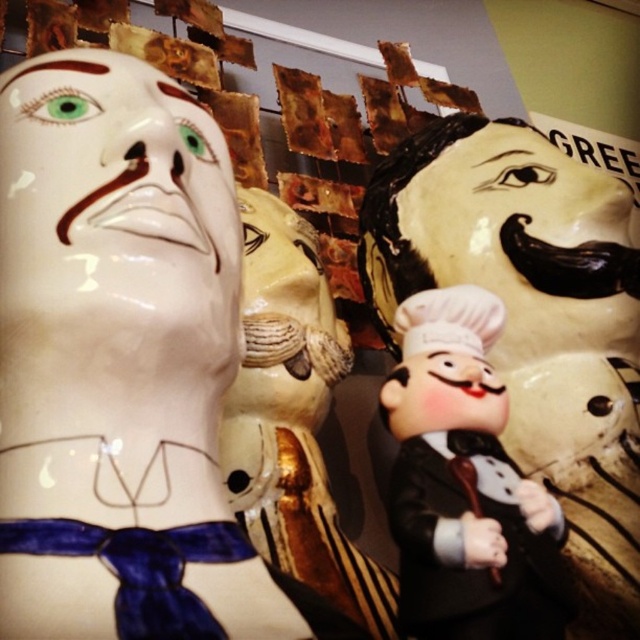
Describe the element at coordinates (532, 320) in the screenshot. I see `matte black chef figurine at center` at that location.

Can you confirm if matte black chef figurine at center is thinner than matte gold mask at center?

Incorrect, matte black chef figurine at center's width is not less than matte gold mask at center's.

Is point (573, 445) closer to viewer compared to point (330, 593)?

No, it is behind (330, 593).

You are a GUI agent. You are given a task and a screenshot of the screen. Output one action in this format:
    pyautogui.click(x=<x>, y=<y>)
    Task: Click on the matte black chef figurine at center
    This screenshot has width=640, height=640.
    Given the screenshot: What is the action you would take?
    pyautogui.click(x=532, y=320)

Which of these two, matte black chef figurine at center or matte plastic chef at center, stands shorter?

matte plastic chef at center

Is matte black chef figurine at center above matte plastic chef at center?

Yes.

You are a GUI agent. You are given a task and a screenshot of the screen. Output one action in this format:
    pyautogui.click(x=<x>, y=<y>)
    Task: Click on the matte black chef figurine at center
    This screenshot has width=640, height=640.
    Given the screenshot: What is the action you would take?
    [x=532, y=320]

This screenshot has width=640, height=640. Find the location of `matte black chef figurine at center`. matte black chef figurine at center is located at coordinates (532, 320).

Looking at this image, is white glossy mask at upper left in front of matte gold mask at center?

That is True.

Measure the distance between white glossy mask at upper left and matte gold mask at center.

white glossy mask at upper left is 13.08 inches from matte gold mask at center.

Is point (116, 348) behind point (266, 406)?

No, it is not.

Where is `white glossy mask at upper left`? The height and width of the screenshot is (640, 640). white glossy mask at upper left is located at coordinates (113, 294).